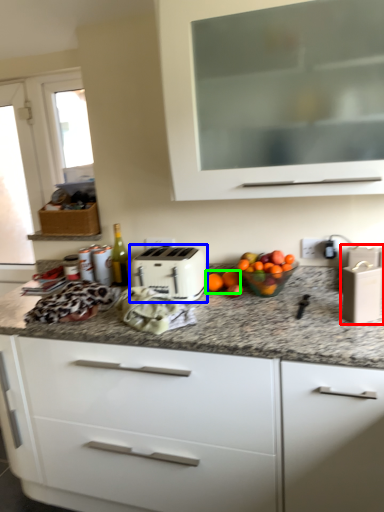
Question: Which is farther away from appliance (highlighted by a red box)? toaster (highlighted by a blue box) or citrus fruit (highlighted by a green box)?

Choices:
 (A) toaster
 (B) citrus fruit

Answer: (A)